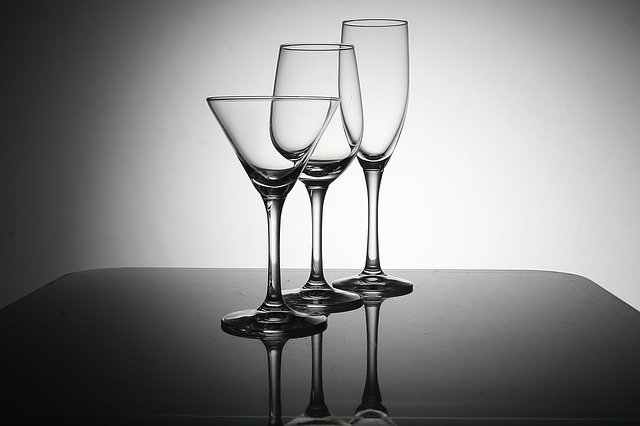
Where is `table`? table is located at coordinates (474, 330), (131, 344), (572, 408), (202, 399).